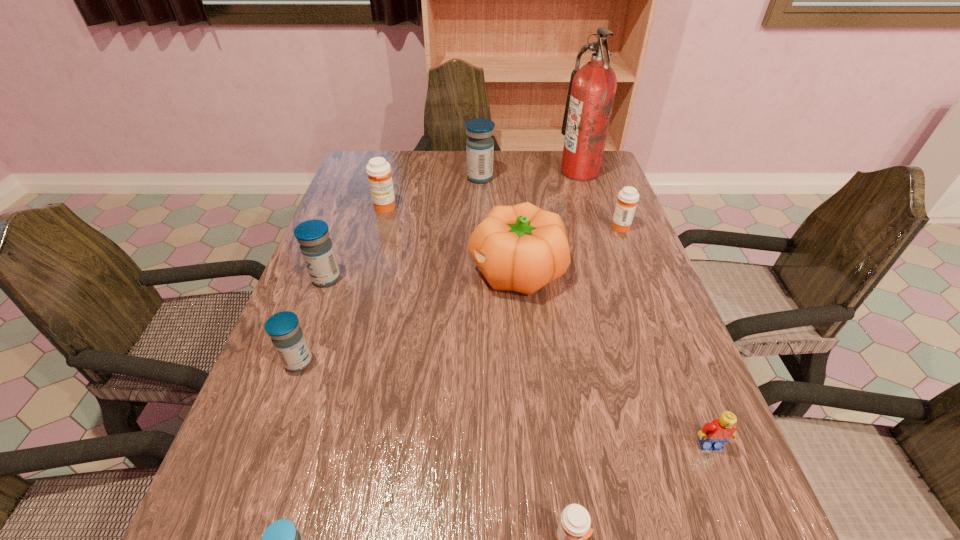
Identify the location of the tallest object. This screenshot has height=540, width=960. (592, 88).

Image resolution: width=960 pixels, height=540 pixels. In order to click on red fire extinguisher in this screenshot , I will do `click(592, 88)`.

Where is `the rightmost blue medicine`? The image size is (960, 540). the rightmost blue medicine is located at coordinates (479, 145).

I want to click on the farthest medicine, so click(479, 145).

Find the location of a particular element. The image size is (960, 540). pumpkin is located at coordinates (521, 248).

Identify the location of the leftmost orange medicine. This screenshot has height=540, width=960. (378, 170).

Locate an element on the screen. the biggest orange medicine is located at coordinates (378, 170).

In order to click on the third smallest blue medicine in this screenshot , I will do `click(316, 247)`.

At what (x,y) coordinates should I click in order to perform the action: click on the second farthest blue medicine. Please return your answer as a coordinate pair (x, y). The height and width of the screenshot is (540, 960). Looking at the image, I should click on (316, 247).

At what (x,y) coordinates should I click in order to perform the action: click on the rightmost medicine. Please return your answer as a coordinate pair (x, y). The width and height of the screenshot is (960, 540). Looking at the image, I should click on point(628,197).